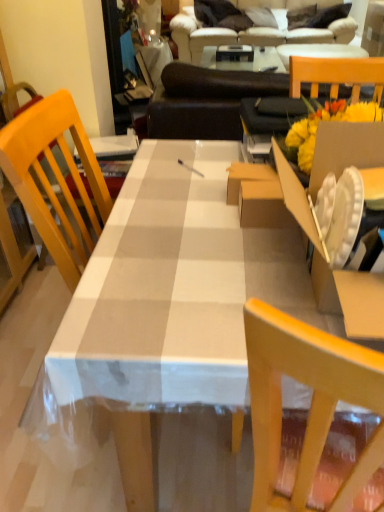
Image resolution: width=384 pixels, height=512 pixels. I want to click on blank space to the left of wooden chair at right, so click(192, 165).